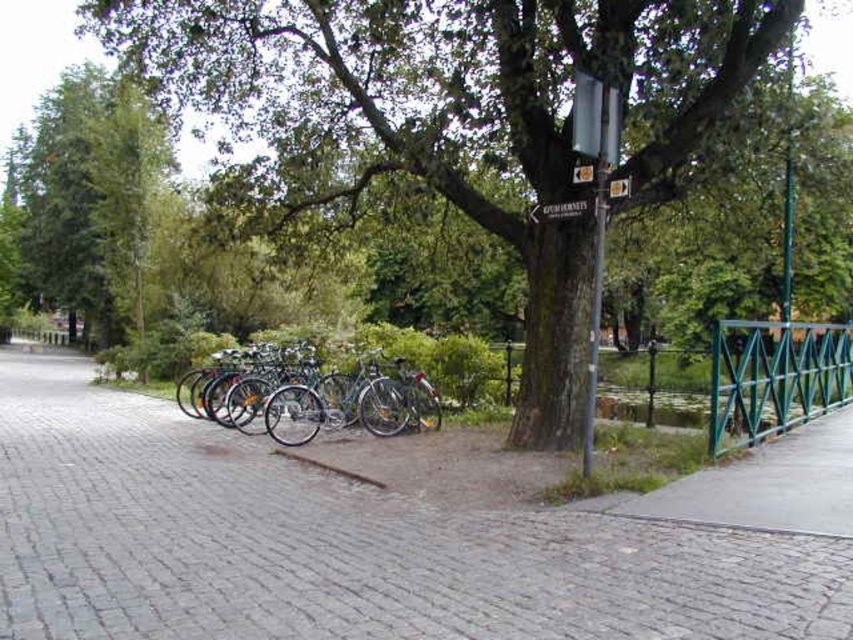
Question: Which of these objects is positioned farthest from the green leafy tree at left?

Choices:
 (A) green metallic railing at right
 (B) green rough bark tree at center
 (C) metallic pole at center-right

Answer: (A)

Question: Which of these objects is positioned closest to the green metallic railing at right?

Choices:
 (A) green leafy tree at left
 (B) shiny metallic bicycles at center
 (C) green rough bark tree at center
 (D) gray cobblestone pavement at center

Answer: (D)

Question: Does green rough bark tree at center have a lesser width compared to shiny metallic bicycles at center?

Choices:
 (A) yes
 (B) no

Answer: (B)

Question: Is shiny metallic bicycles at center above green metal fence at right?

Choices:
 (A) no
 (B) yes

Answer: (A)

Question: Can you confirm if green rough bark tree at center is positioned below shiny metallic bicycles at center?

Choices:
 (A) yes
 (B) no

Answer: (B)

Question: Which point appears farthest from the camera in this image?

Choices:
 (A) (547, 205)
 (B) (404, 400)
 (C) (828, 358)

Answer: (C)